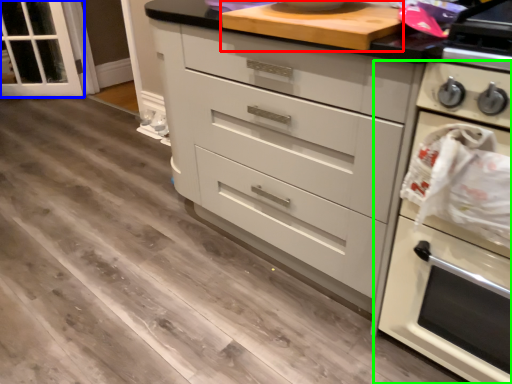
Question: Which object is the farthest from appliance (highlighted by a red box)? Choose among these: glass door (highlighted by a blue box) or home appliance (highlighted by a green box).

Choices:
 (A) glass door
 (B) home appliance

Answer: (A)